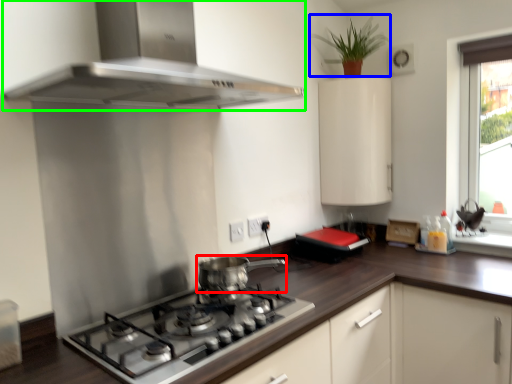
Question: Based on their relative distances, which object is nearer to kitchen appliance (highlighted by a red box)? Choose from plant (highlighted by a blue box) and home appliance (highlighted by a green box).

Choices:
 (A) plant
 (B) home appliance

Answer: (B)